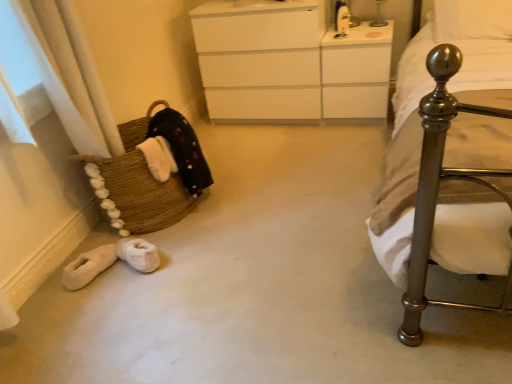
Question: Is point (379, 24) closer or farther from the camera than point (437, 66)?

Choices:
 (A) closer
 (B) farther

Answer: (B)

Question: From the image's perspective, is metallic glass table lamp at upper center above or below polished metal bed at right?

Choices:
 (A) above
 (B) below

Answer: (A)

Question: Which object is positioned closest to the white soft pillow at upper right?

Choices:
 (A) metallic glass table lamp at upper center
 (B) polished metal bed at right
 (C) brown woven basket at left
 (D) white glossy vanity at upper center
 (E) white matte chest of drawers at center

Answer: (B)

Question: Which object is positioned closest to the white glossy vanity at upper center?

Choices:
 (A) metallic glass table lamp at upper center
 (B) brown woven basket at left
 (C) polished metal bed at right
 (D) white soft pillow at upper right
 (E) white matte chest of drawers at center

Answer: (E)